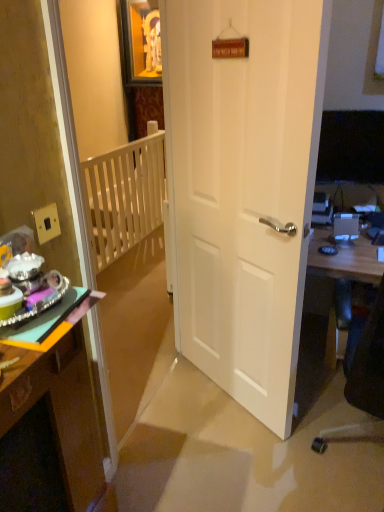
Find the location of a particular element. The image size is (384, 512). free space in front of white wooden bunk bed at upper left is located at coordinates (173, 449).